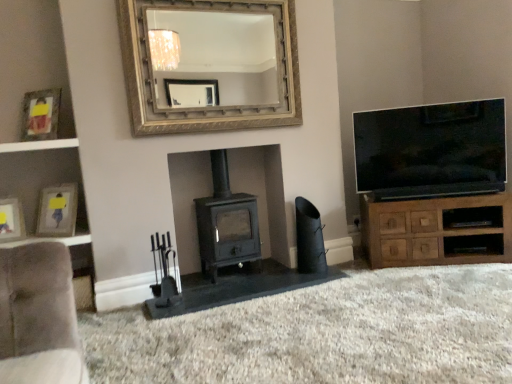
Image resolution: width=512 pixels, height=384 pixels. I want to click on empty space that is ontop of flat-screen tv at right (from a real-world perspective), so click(x=431, y=107).